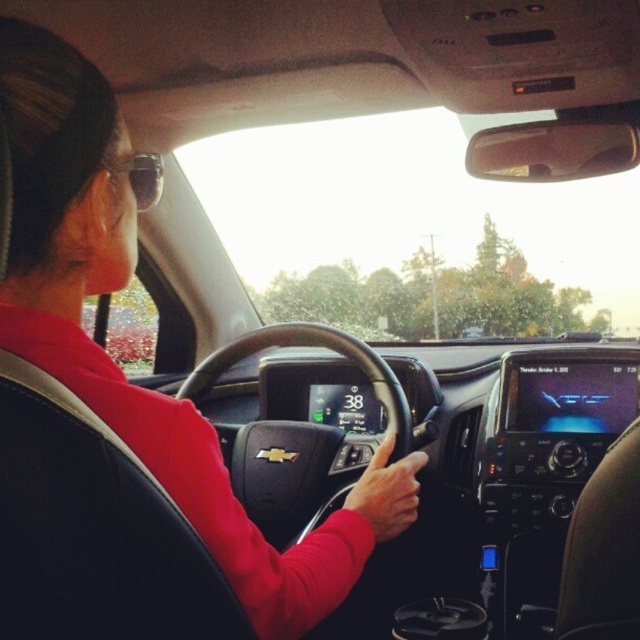
You are a passenger in the Chevrolet Volt electric vehicle. You want to check the speed displayed on the dashboard. Where should you look relative to the black leather steering wheel at center?

The dashboard is located in front of the black leather steering wheel at center, so you should look forward towards the steering wheel to see the speed display.

You are a passenger in the Chevrolet Volt electric vehicle and want to know if the black leather steering wheel at center can block your view of the sunglasses at upper left. Based on their sizes, can it?

The black leather steering wheel at center is bigger than sunglasses at upper left, so it can potentially block the view of the sunglasses at upper left depending on the angle and positioning.

In the scene shown: You are a passenger in the Chevrolet Volt electric vehicle and notice the black leather steering wheel at center and the sunglasses at upper left. From your perspective, which object is positioned to the right of the other?

The black leather steering wheel at center is to the right of sunglasses at upper left.